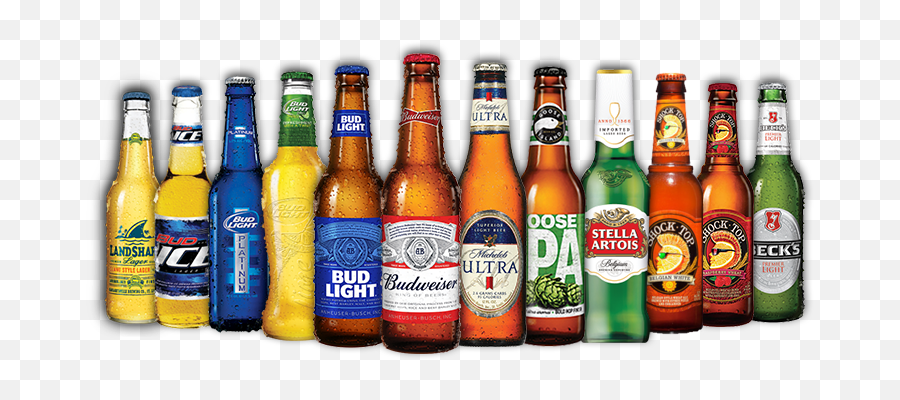
I want to click on colored bottles, so click(x=240, y=161), click(x=348, y=157), click(x=426, y=160), click(x=497, y=161), click(x=543, y=160), click(x=614, y=173), click(x=672, y=178), click(x=724, y=188), click(x=786, y=187).